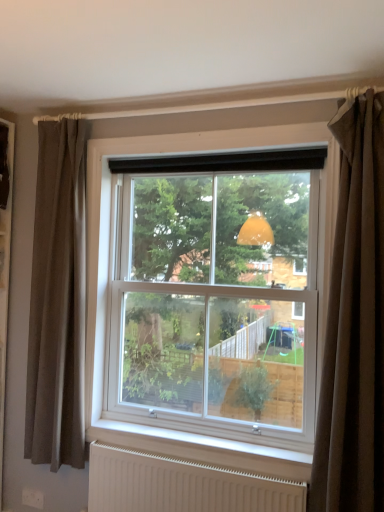
Question: Should I look upward or downward to see brown fabric curtain at right, arranged as the first curtain when viewed from the front?

Choices:
 (A) down
 (B) up

Answer: (A)

Question: Is white matte radiator at lower center placed right next to brown fabric curtain at left, which ranks as the second curtain in front-to-back order?

Choices:
 (A) no
 (B) yes

Answer: (A)

Question: Considering the relative sizes of white matte radiator at lower center and brown fabric curtain at left, acting as the first curtain starting from the left, in the image provided, is white matte radiator at lower center taller than brown fabric curtain at left, acting as the first curtain starting from the left,?

Choices:
 (A) yes
 (B) no

Answer: (B)

Question: Can you confirm if white matte radiator at lower center is wider than brown fabric curtain at left, which ranks as the second curtain in front-to-back order?

Choices:
 (A) no
 (B) yes

Answer: (A)

Question: Could brown fabric curtain at left, acting as the first curtain starting from the left, be considered to be inside white matte radiator at lower center?

Choices:
 (A) no
 (B) yes

Answer: (A)

Question: Is white matte radiator at lower center positioned behind brown fabric curtain at left, which ranks as the second curtain in front-to-back order?

Choices:
 (A) yes
 (B) no

Answer: (B)

Question: Considering the relative sizes of white matte radiator at lower center and brown fabric curtain at left, which ranks as the second curtain in front-to-back order, in the image provided, is white matte radiator at lower center shorter than brown fabric curtain at left, which ranks as the second curtain in front-to-back order,?

Choices:
 (A) yes
 (B) no

Answer: (A)

Question: From the image's perspective, is white plastic window at center above white matte radiator at lower center?

Choices:
 (A) yes
 (B) no

Answer: (A)

Question: Is white plastic window at center looking in the opposite direction of white matte radiator at lower center?

Choices:
 (A) no
 (B) yes

Answer: (A)

Question: Does white plastic window at center appear on the right side of white matte radiator at lower center?

Choices:
 (A) yes
 (B) no

Answer: (A)

Question: Is white plastic window at center closer to the viewer compared to white matte radiator at lower center?

Choices:
 (A) yes
 (B) no

Answer: (B)

Question: Is white plastic window at center wider than white matte radiator at lower center?

Choices:
 (A) yes
 (B) no

Answer: (A)

Question: Can you confirm if white plastic window at center is thinner than white matte radiator at lower center?

Choices:
 (A) yes
 (B) no

Answer: (B)

Question: From the image's perspective, is white matte radiator at lower center below white plastic window at center?

Choices:
 (A) yes
 (B) no

Answer: (A)